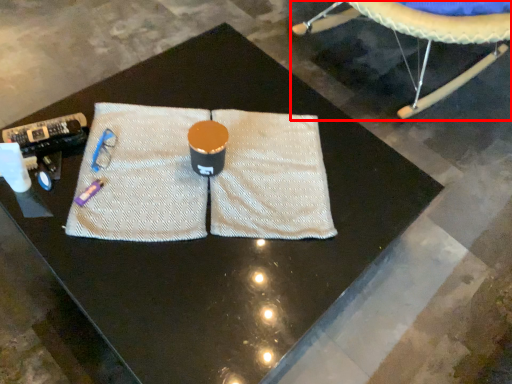
Question: Where is swivel chair (annotated by the red box) located in relation to yoga mat in the image?

Choices:
 (A) left
 (B) right

Answer: (B)